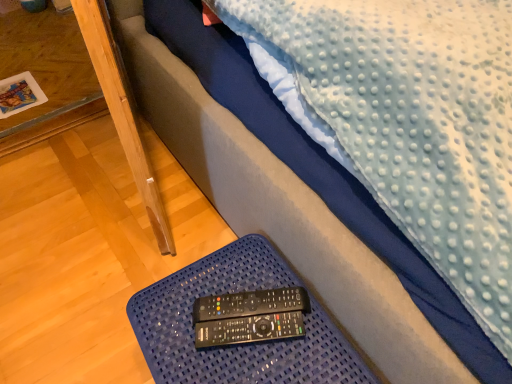
Question: Can you confirm if black plastic remote at lower center, the 2th control when ordered from back to front, is taller than blue textured tray at lower center?

Choices:
 (A) no
 (B) yes

Answer: (A)

Question: Does black plastic remote at lower center, the 2th control when ordered from back to front, have a lesser width compared to blue textured tray at lower center?

Choices:
 (A) yes
 (B) no

Answer: (A)

Question: Does black plastic remote at lower center, the 1th control viewed from the front, appear on the right side of blue textured tray at lower center?

Choices:
 (A) no
 (B) yes

Answer: (B)

Question: Can you confirm if black plastic remote at lower center, the 1th control viewed from the front, is shorter than blue textured tray at lower center?

Choices:
 (A) no
 (B) yes

Answer: (B)

Question: Considering the relative sizes of black plastic remote at lower center, the 2th control when ordered from back to front, and blue textured tray at lower center in the image provided, is black plastic remote at lower center, the 2th control when ordered from back to front, smaller than blue textured tray at lower center?

Choices:
 (A) no
 (B) yes

Answer: (B)

Question: From a real-world perspective, relative to wooden table at lower left, is blue textured tray at lower center vertically above or below?

Choices:
 (A) below
 (B) above

Answer: (B)

Question: Is blue textured tray at lower center taller or shorter than wooden table at lower left?

Choices:
 (A) tall
 (B) short

Answer: (A)

Question: In the image, is blue textured tray at lower center positioned in front of or behind wooden table at lower left?

Choices:
 (A) behind
 (B) front

Answer: (B)

Question: Considering the relative positions of blue textured tray at lower center and wooden table at lower left in the image provided, is blue textured tray at lower center to the left or to the right of wooden table at lower left?

Choices:
 (A) right
 (B) left

Answer: (A)

Question: From a real-world perspective, is black plastic remote at lower center, the 2th control when ordered from back to front, above or below wooden table at lower left?

Choices:
 (A) below
 (B) above

Answer: (B)

Question: Does point (198, 327) appear closer or farther from the camera than point (16, 132)?

Choices:
 (A) closer
 (B) farther

Answer: (A)

Question: From the image's perspective, is black plastic remote at lower center, the 2th control when ordered from back to front, positioned above or below wooden table at lower left?

Choices:
 (A) below
 (B) above

Answer: (A)

Question: Considering the positions of black plastic remote at lower center, the 2th control when ordered from back to front, and wooden table at lower left in the image, is black plastic remote at lower center, the 2th control when ordered from back to front, wider or thinner than wooden table at lower left?

Choices:
 (A) thin
 (B) wide

Answer: (A)

Question: Looking at their shapes, would you say black plastic remote at lower center, which is counted as the second control, starting from the front, is wider or thinner than black plastic remote at lower center, the 2th control when ordered from back to front?

Choices:
 (A) thin
 (B) wide

Answer: (B)

Question: In terms of size, does black plastic remote at lower center, which is counted as the second control, starting from the front, appear bigger or smaller than black plastic remote at lower center, the 1th control viewed from the front?

Choices:
 (A) big
 (B) small

Answer: (B)